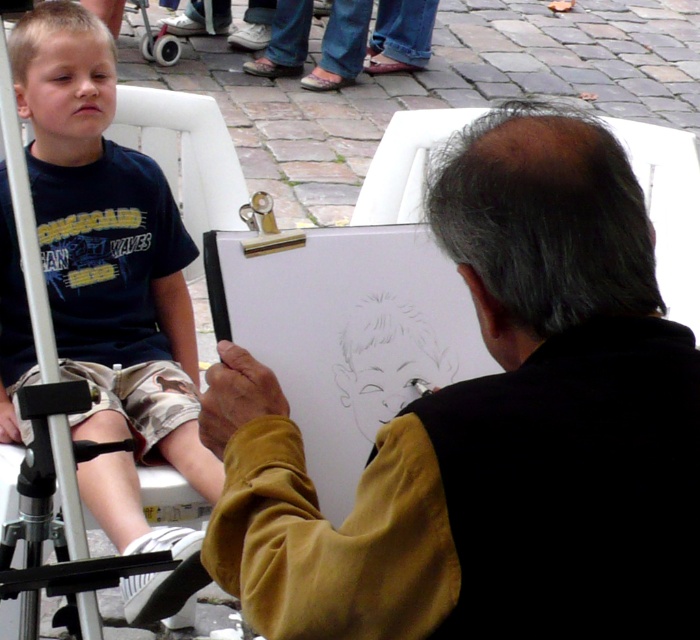
Question: Among these points, which one is nearest to the camera?

Choices:
 (A) (108, 273)
 (B) (518, 604)

Answer: (B)

Question: In this image, where is smooth black jacket at center located relative to matte black shorts at left?

Choices:
 (A) below
 (B) above

Answer: (A)

Question: Which point appears farthest from the camera in this image?

Choices:
 (A) click(456, 221)
 (B) click(119, 179)

Answer: (B)

Question: Does smooth black jacket at center lie behind matte black shorts at left?

Choices:
 (A) yes
 (B) no

Answer: (B)

Question: Does smooth black jacket at center appear over matte black shorts at left?

Choices:
 (A) yes
 (B) no

Answer: (B)

Question: Which point appears closest to the camera in this image?

Choices:
 (A) (680, 397)
 (B) (146, 452)

Answer: (A)